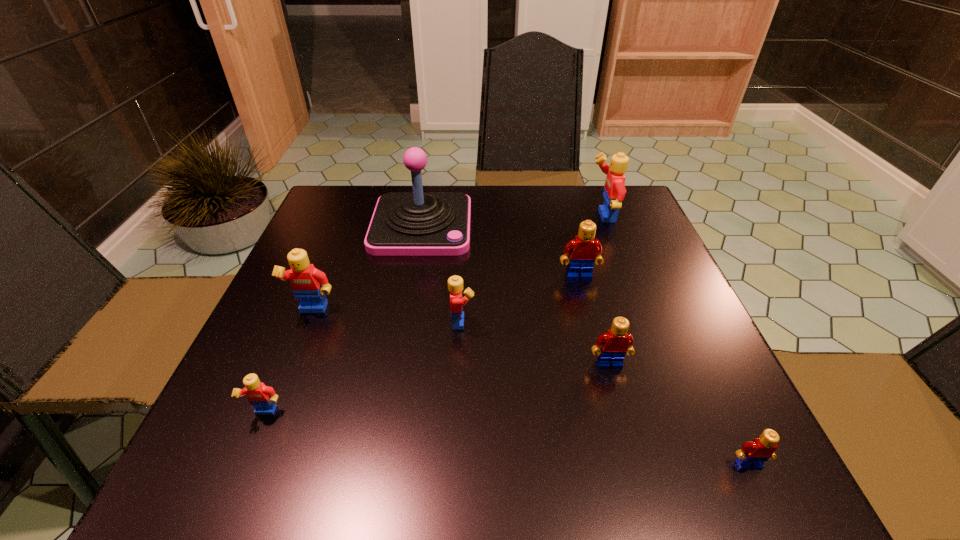
This screenshot has height=540, width=960. I want to click on free space located on the face of the second biggest yellow Lego, so click(259, 449).

Where is `free space located on the face of the third yellow Lego from left to right`? This screenshot has height=540, width=960. free space located on the face of the third yellow Lego from left to right is located at coordinates (583, 321).

The width and height of the screenshot is (960, 540). In order to click on vacant space located on the front-facing side of the second farthest red Lego in this screenshot , I will do `click(634, 455)`.

Locate an element on the screen. joystick that is at the far edge is located at coordinates (417, 223).

Where is `Lego that is positioned at the far edge`? Lego that is positioned at the far edge is located at coordinates (614, 192).

Where is `object that is at the near edge`? object that is at the near edge is located at coordinates (752, 455).

The image size is (960, 540). I want to click on joystick that is at the left edge, so click(x=417, y=223).

I want to click on object situated at the far left corner, so click(417, 223).

This screenshot has height=540, width=960. I want to click on object that is at the far right corner, so click(614, 192).

Where is `object situated at the near right corner`? object situated at the near right corner is located at coordinates (752, 455).